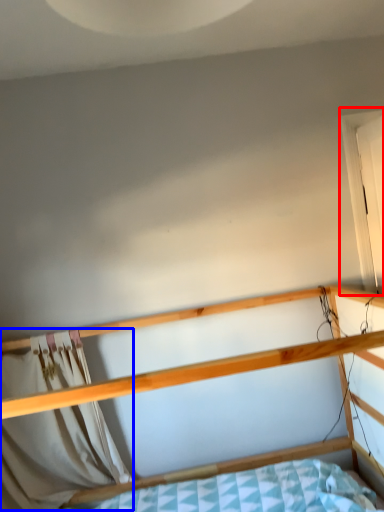
Question: Which object appears closest to the camera in this image, window (highlighted by a red box) or curtain (highlighted by a blue box)?

Choices:
 (A) window
 (B) curtain

Answer: (A)